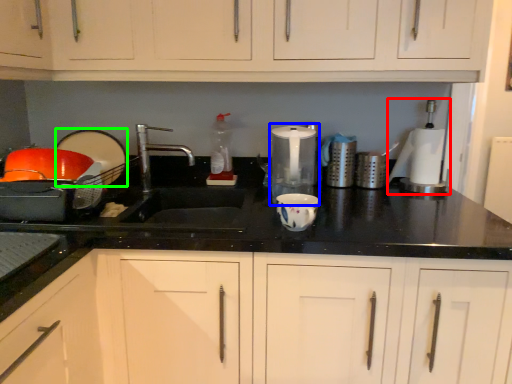
Question: Which is nearer to the blender (highlighted by a red box)? appliance (highlighted by a blue box) or appliance (highlighted by a green box).

Choices:
 (A) appliance
 (B) appliance

Answer: (A)